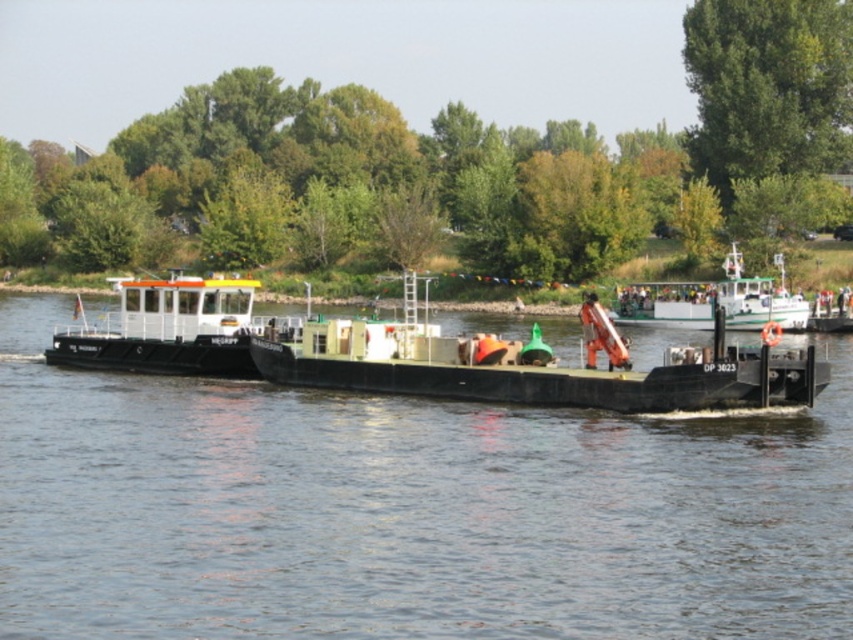
You are a river tour guide and need to inform passengers about the vessels. Which vessel is shorter between the black rubber boat at center and the green matte barge at center?

The black rubber boat at center is shorter than the green matte barge at center.

You are a dock worker who needs to load a cargo container that is 10 meters wide onto a barge. You see the green matte barge at center and the white matte barge at left. Which barge can accommodate the cargo container based on their widths?

The green matte barge at center has a larger width than the white matte barge at left, so it can accommodate the 10 meters wide cargo container.

You are standing on the deck of the barge with the red crane arm. You see two points marked on the water surface ahead of you. The first point is at coordinates point (595,372) and the second point is at coordinates point (299,337). Which point is closer to you?

Point (595,372) is closer to the viewer than point (299,337).